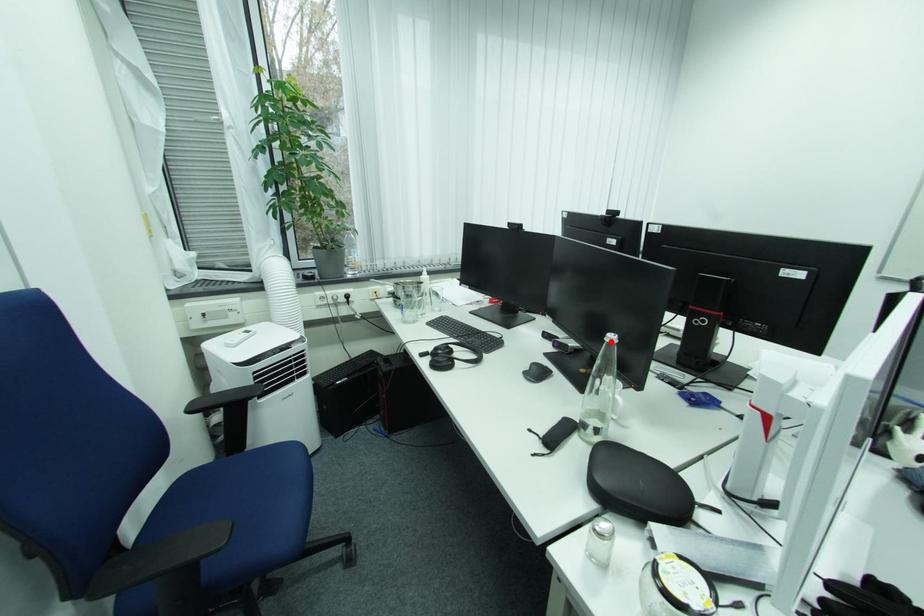
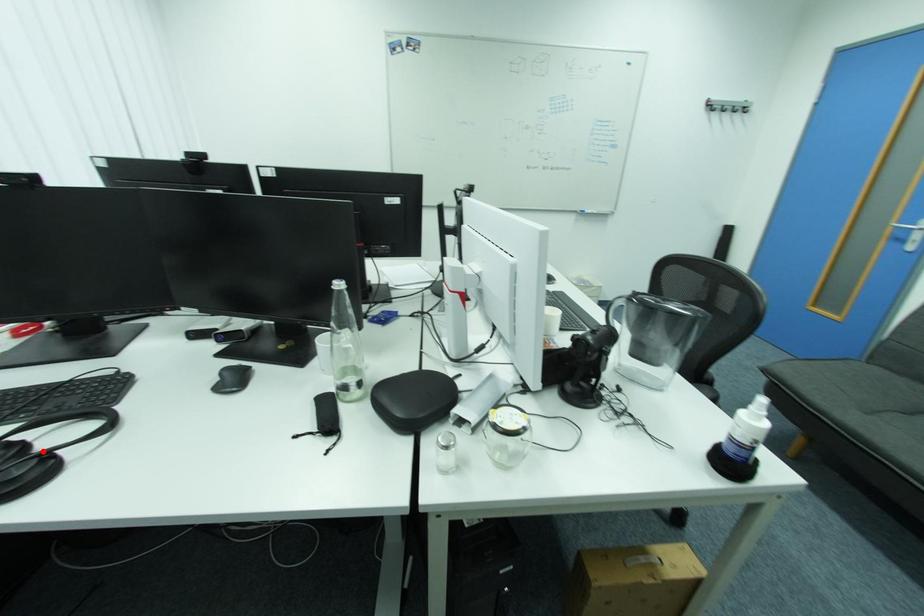
I am providing you with two images of the same scene from different viewpoints. A red point is marked on the first image and another point is marked on the second image. Does the point marked in image1 correspond to the same location as the one in image2?

No